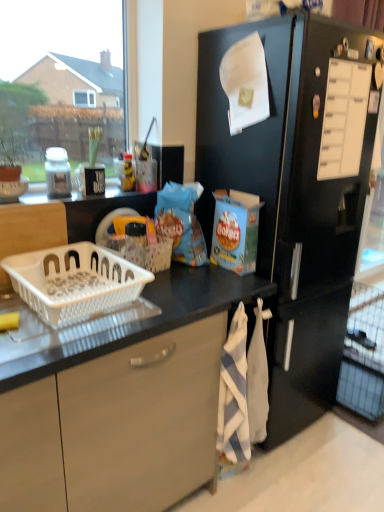
What do you see at coordinates (74, 281) in the screenshot? The image size is (384, 512). I see `white plastic basket at lower left, which ranks as the first basket in front-to-back order` at bounding box center [74, 281].

How much space does white plastic basket at lower left, which is the second basket from back to front, occupy horizontally?

white plastic basket at lower left, which is the second basket from back to front, is 18.86 inches in width.

Describe the element at coordinates (143, 252) in the screenshot. The width and height of the screenshot is (384, 512). I see `white plastic basket at center, which is counted as the 1th basket, starting from the back` at that location.

What do you see at coordinates (57, 173) in the screenshot? I see `white matte jar at left` at bounding box center [57, 173].

Where is `black matte refrigerator at right`? The height and width of the screenshot is (512, 384). black matte refrigerator at right is located at coordinates (292, 203).

The image size is (384, 512). What are the coordinates of `white plastic basket at lower left, which is the second basket from back to front` in the screenshot? It's located at (74, 281).

Who is shorter, white striped towel at lower center or white plastic basket at lower left, which ranks as the first basket in front-to-back order?

white plastic basket at lower left, which ranks as the first basket in front-to-back order, is shorter.

In terms of width, does white striped towel at lower center look wider or thinner when compared to white plastic basket at lower left, which ranks as the first basket in front-to-back order?

white striped towel at lower center is thinner than white plastic basket at lower left, which ranks as the first basket in front-to-back order.

In the image, is white striped towel at lower center on the left side or the right side of white plastic basket at lower left, which is the second basket from back to front?

Clearly, white striped towel at lower center is on the right of white plastic basket at lower left, which is the second basket from back to front, in the image.

Is white plastic drawer at upper right far away from black matte refrigerator at right?

That's not correct — white plastic drawer at upper right is a little close to black matte refrigerator at right.

From the picture: From the image's perspective, who appears lower, white plastic drawer at upper right or black matte refrigerator at right?

black matte refrigerator at right appears lower in the image.

From a real-world perspective, between white plastic drawer at upper right and black matte refrigerator at right, who is vertically higher?

white plastic drawer at upper right.

Which is more to the right, white plastic drawer at upper right or black matte refrigerator at right?

white plastic drawer at upper right.

Is point (248, 435) positioned behind point (318, 162)?

Yes, it is behind point (318, 162).

Who is taller, white striped towel at lower center or white plastic drawer at upper right?

Standing taller between the two is white striped towel at lower center.

Considering the sizes of objects white striped towel at lower center and white plastic drawer at upper right in the image provided, who is bigger, white striped towel at lower center or white plastic drawer at upper right?

white striped towel at lower center is bigger.

Is the depth of white plastic basket at center, acting as the 2th basket starting from the front, less than that of white plastic basket at lower left, which ranks as the first basket in front-to-back order?

No, the depth of white plastic basket at center, acting as the 2th basket starting from the front, is greater than that of white plastic basket at lower left, which ranks as the first basket in front-to-back order.

Does white plastic basket at center, acting as the 2th basket starting from the front, turn towards white plastic basket at lower left, which is the second basket from back to front?

No, white plastic basket at center, acting as the 2th basket starting from the front, is not turned towards white plastic basket at lower left, which is the second basket from back to front.

Which object is positioned more to the left, white plastic basket at center, which is counted as the 1th basket, starting from the back, or white plastic basket at lower left, which ranks as the first basket in front-to-back order?

white plastic basket at lower left, which ranks as the first basket in front-to-back order.

Considering the positions of objects white matte jar at left and black matte refrigerator at right in the image provided, who is more to the right, white matte jar at left or black matte refrigerator at right?

From the viewer's perspective, black matte refrigerator at right appears more on the right side.

Is white matte jar at left taller or shorter than black matte refrigerator at right?

In the image, white matte jar at left appears to be shorter than black matte refrigerator at right.

Is white matte jar at left oriented towards black matte refrigerator at right?

No, white matte jar at left does not turn towards black matte refrigerator at right.

How many degrees apart are the facing directions of white matte jar at left and black matte refrigerator at right?

The angle between the facing direction of white matte jar at left and the facing direction of black matte refrigerator at right is 0.0502 degrees.

From the picture: Are white matte jar at left and white plastic drawer at upper right far apart?

white matte jar at left is far away from white plastic drawer at upper right.

Who is more distant, white matte jar at left or white plastic drawer at upper right?

white matte jar at left is behind.

Between white matte jar at left and white plastic drawer at upper right, which one has more height?

white plastic drawer at upper right is taller.

Measure the distance between white matte jar at left and white plastic drawer at upper right.

A distance of 3.59 feet exists between white matte jar at left and white plastic drawer at upper right.

Find the location of a particular element. The width and height of the screenshot is (384, 512). bottle that appears behind the white plastic basket at center, acting as the 2th basket starting from the front is located at coordinates [57, 173].

From the image's perspective, is white plastic basket at center, acting as the 2th basket starting from the front, located above or below white matte jar at left?

From the image's perspective, white plastic basket at center, acting as the 2th basket starting from the front, appears below white matte jar at left.

Is white plastic basket at center, which is counted as the 1th basket, starting from the back, facing towards white matte jar at left?

No, white plastic basket at center, which is counted as the 1th basket, starting from the back, is not oriented towards white matte jar at left.

Does white plastic basket at center, which is counted as the 1th basket, starting from the back, have a lesser width compared to white matte jar at left?

In fact, white plastic basket at center, which is counted as the 1th basket, starting from the back, might be wider than white matte jar at left.

Identify the location of laundry on the right of white plastic basket at lower left, which ranks as the first basket in front-to-back order. The height and width of the screenshot is (512, 384). click(x=243, y=388).

Where is `drawer above the black matte refrigerator at right (from a real-world perspective)`? This screenshot has width=384, height=512. drawer above the black matte refrigerator at right (from a real-world perspective) is located at coordinates (344, 119).

When comparing their distances from white striped towel at lower center, does white plastic basket at center, acting as the 2th basket starting from the front, or black matte refrigerator at right seem further?

white plastic basket at center, acting as the 2th basket starting from the front, is further to white striped towel at lower center.

Looking at the image, which one is located further to white plastic basket at lower left, which ranks as the first basket in front-to-back order, white striped towel at lower center or black matte refrigerator at right?

black matte refrigerator at right lies further to white plastic basket at lower left, which ranks as the first basket in front-to-back order, than the other object.

From the image, which object appears to be nearer to white plastic basket at lower left, which ranks as the first basket in front-to-back order, white plastic drawer at upper right or white plastic basket at center, acting as the 2th basket starting from the front?

white plastic basket at center, acting as the 2th basket starting from the front.

Looking at the image, which one is located closer to white matte jar at left, white plastic basket at center, acting as the 2th basket starting from the front, or white striped towel at lower center?

white plastic basket at center, acting as the 2th basket starting from the front, is closer to white matte jar at left.

In the scene shown: Which object lies nearer to the anchor point white plastic drawer at upper right, white plastic basket at center, acting as the 2th basket starting from the front, or white plastic basket at lower left, which is the second basket from back to front?

Among the two, white plastic basket at center, acting as the 2th basket starting from the front, is located nearer to white plastic drawer at upper right.

From the image, which object appears to be farther from white plastic drawer at upper right, white striped towel at lower center or black matte refrigerator at right?

white striped towel at lower center.

Considering their positions, is white matte jar at left positioned closer to white plastic basket at lower left, which is the second basket from back to front, than white striped towel at lower center?

The object closer to white plastic basket at lower left, which is the second basket from back to front, is white matte jar at left.

Consider the image. From the image, which object appears to be nearer to black matte refrigerator at right, white matte jar at left or white plastic basket at center, which is counted as the 1th basket, starting from the back?

white plastic basket at center, which is counted as the 1th basket, starting from the back, lies closer to black matte refrigerator at right than the other object.

Find the location of a particular element. This screenshot has width=384, height=512. laundry situated between white plastic basket at center, acting as the 2th basket starting from the front, and black matte refrigerator at right from left to right is located at coordinates (243, 388).

The image size is (384, 512). Identify the location of refrigerator situated between white plastic basket at lower left, which is the second basket from back to front, and white plastic drawer at upper right from left to right. (292, 203).

You are a GUI agent. You are given a task and a screenshot of the screen. Output one action in this format:
    pyautogui.click(x=<x>, y=<y>)
    Task: Click on the basket between white plastic basket at lower left, which ranks as the first basket in front-to-back order, and white striped towel at lower center
    
    Given the screenshot: What is the action you would take?
    pyautogui.click(x=143, y=252)

What are the coordinates of `refrigerator between white plastic basket at center, which is counted as the 1th basket, starting from the back, and white plastic drawer at upper right, in the horizontal direction` in the screenshot? It's located at (292, 203).